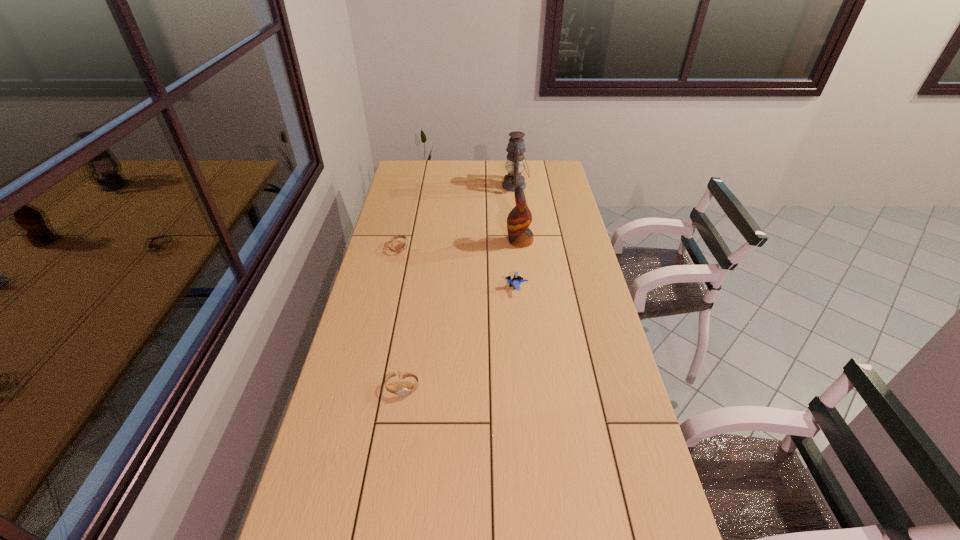
This screenshot has height=540, width=960. Identify the location of blank area located 0.360m on the face of the parrot. (420, 241).

This screenshot has width=960, height=540. Find the location of `free spot located 0.250m on the face of the parrot`. free spot located 0.250m on the face of the parrot is located at coordinates (446, 241).

The height and width of the screenshot is (540, 960). I want to click on free location located 0.260m on the front-facing side of the second nearest object, so [x=436, y=287].

What are the coordinates of `free space located 0.070m on the front-facing side of the second nearest object` in the screenshot? It's located at (487, 287).

Find the location of a particular element. free spot located on the front-facing side of the second nearest object is located at coordinates (463, 287).

Locate an element on the screen. This screenshot has width=960, height=540. free region located 0.140m on the face of the left watch is located at coordinates (442, 248).

Locate an element on the screen. vacant space situated on the face of the second object from left to right is located at coordinates (396, 429).

This screenshot has height=540, width=960. Find the location of `object that is positioned at the far edge`. object that is positioned at the far edge is located at coordinates (515, 163).

Locate an element on the screen. This screenshot has width=960, height=540. vacant region at the left edge of the desktop is located at coordinates (347, 434).

In the image, there is a desktop. Where is `free region at the right edge`? This screenshot has width=960, height=540. free region at the right edge is located at coordinates (549, 234).